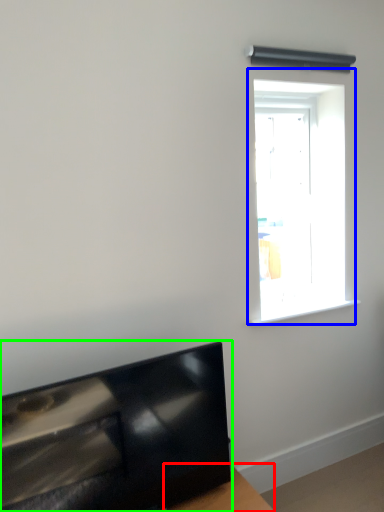
Question: Which is nearer to the table (highlighted by a red box)? window (highlighted by a blue box) or furniture (highlighted by a green box).

Choices:
 (A) window
 (B) furniture

Answer: (B)